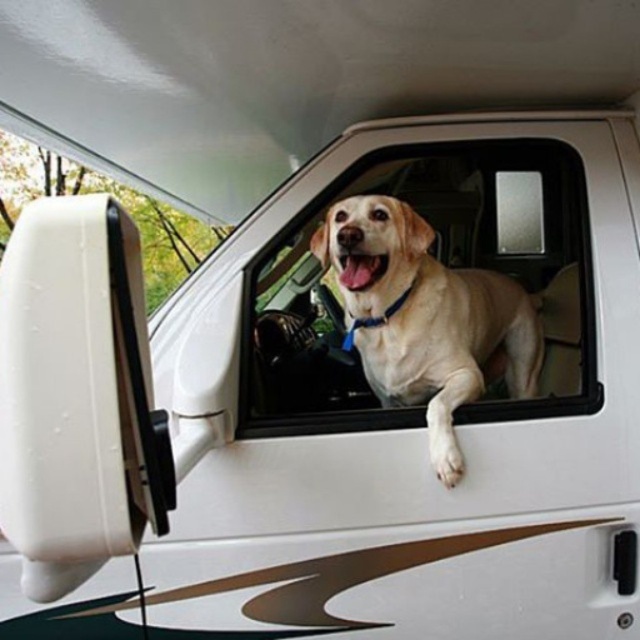
Please describe the location of the light beige fabric car window at center in the RV interior image using coordinates. The coordinates should be in the format of a point with two decimal places, like point x, y.

The light beige fabric car window at center is located at point [428,292].

Looking at this image, you are a passenger in the RV and want to see the golden fur dog at center through the light beige fabric car window at center. Is the dog visible through the window?

The golden fur dog at center is behind the light beige fabric car window at center, so yes, the dog is visible through the window.

You are a passenger in the RV and want to let the golden fur dog at center stick its head out of the light beige fabric car window at center. Based on the window size, will the dog have enough space to do so comfortably?

The light beige fabric car window at center is wider than the golden fur dog at center, so the dog should have enough space to comfortably stick its head out.